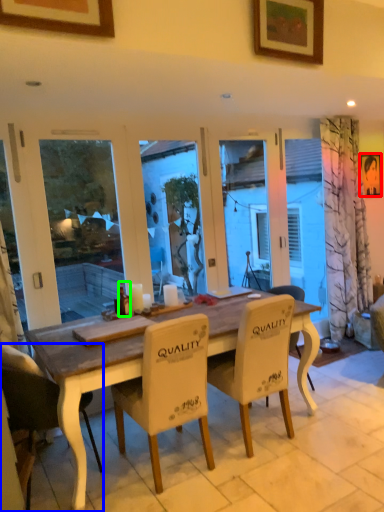
Question: Considering the real-world distances, which object is closest to picture frame (highlighted by a red box)? chair (highlighted by a blue box) or bottle (highlighted by a green box).

Choices:
 (A) chair
 (B) bottle

Answer: (B)